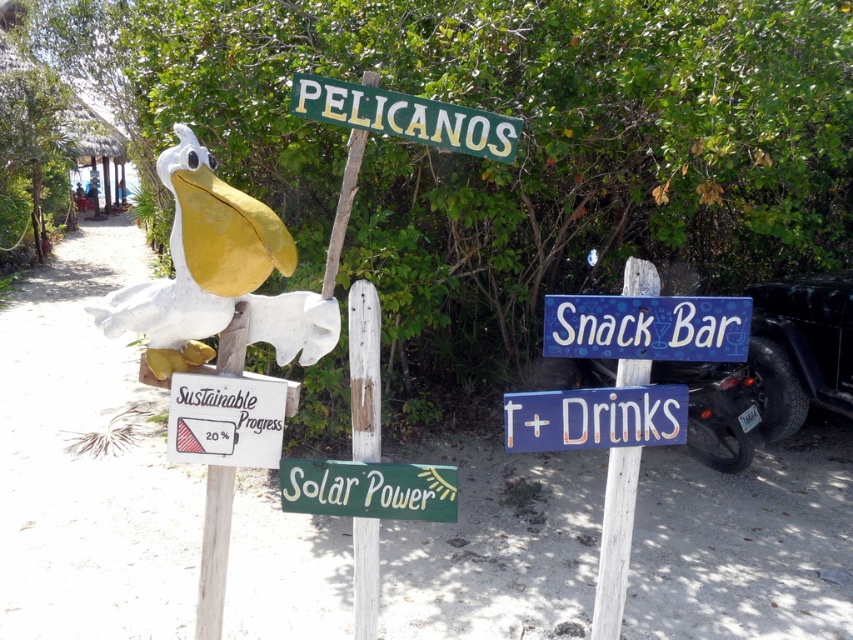
Question: Does green painted wood sign at upper center appear on the right side of white wood pole at center?

Choices:
 (A) no
 (B) yes

Answer: (B)

Question: Is white wood pole at center below white wood signpost at center?

Choices:
 (A) yes
 (B) no

Answer: (B)

Question: Which point is farther to the camera?

Choices:
 (A) green painted wood solar power sign at center
 (B) white wood pole at center

Answer: (B)

Question: Which of the following is the closest to the observer?

Choices:
 (A) (367, 545)
 (B) (215, 467)
 (C) (369, 470)
 (D) (686, 333)

Answer: (C)

Question: Which point appears closest to the camera in this image?

Choices:
 (A) (572, 308)
 (B) (367, 310)
 (C) (653, 284)

Answer: (B)

Question: Is white wooden signpost at center below white wood sign at lower left?

Choices:
 (A) no
 (B) yes

Answer: (B)